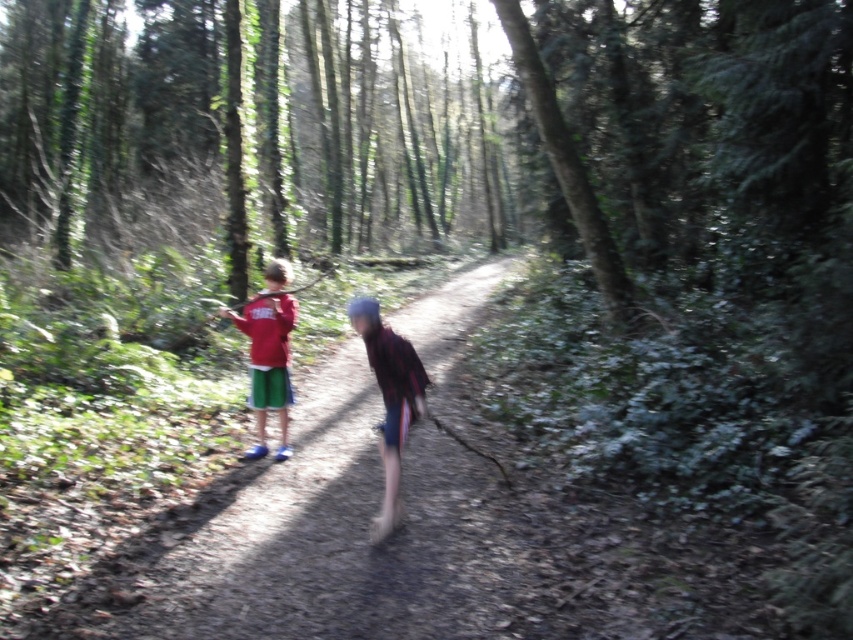
Question: Is green leafy tree at center smaller than plaid fabric shirt at center?

Choices:
 (A) yes
 (B) no

Answer: (B)

Question: Does green leafy tree at center have a smaller size compared to matte red shirt at left?

Choices:
 (A) yes
 (B) no

Answer: (B)

Question: Which of these objects is positioned closest to the plaid fabric shirt at center?

Choices:
 (A) green leafy tree at center
 (B) matte red shirt at left

Answer: (B)

Question: Among these points, which one is nearest to the camera?

Choices:
 (A) (537, 58)
 (B) (395, 342)

Answer: (B)

Question: Observing the image, what is the correct spatial positioning of green leafy tree at center in reference to plaid fabric shirt at center?

Choices:
 (A) left
 (B) right

Answer: (B)

Question: Which point appears farthest from the camera in this image?

Choices:
 (A) (576, 204)
 (B) (268, 268)
 (C) (422, 380)

Answer: (A)